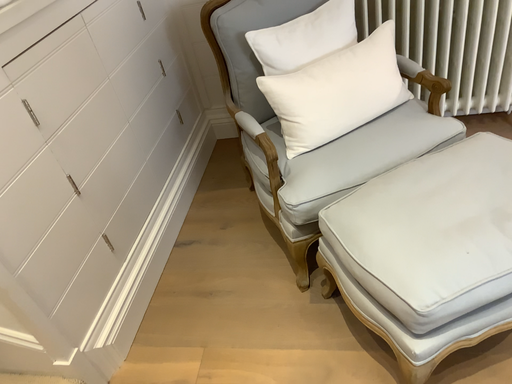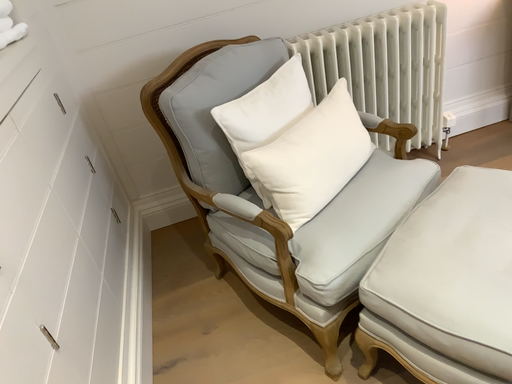
Question: Which way did the camera rotate in the video?

Choices:
 (A) rotated upward
 (B) rotated downward

Answer: (A)